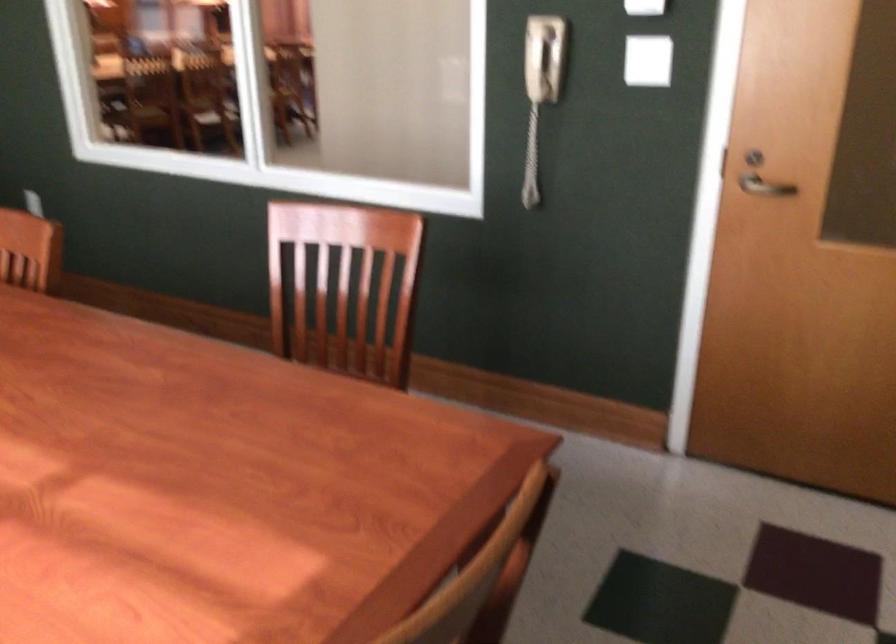
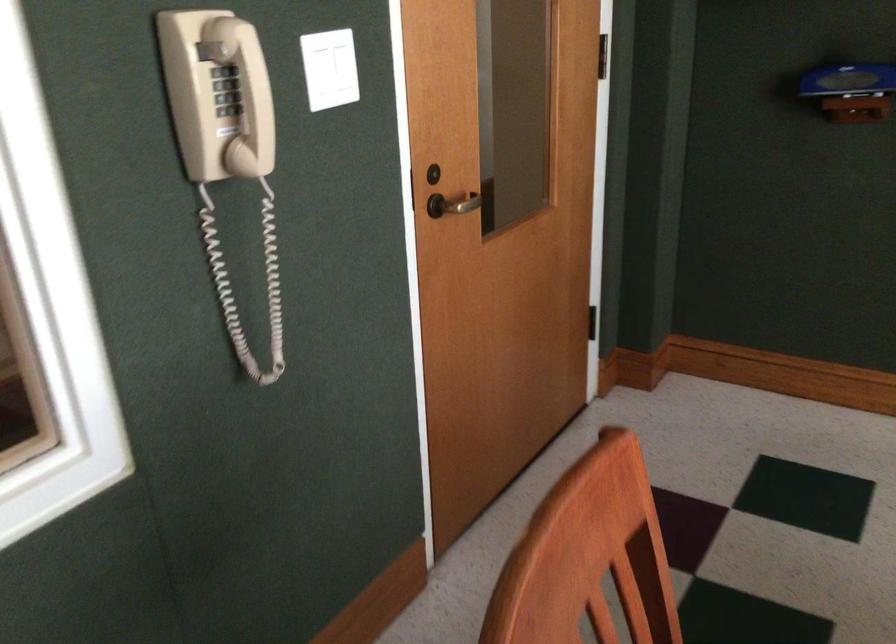
Where in the second image is the point corresponding to (x=750, y=187) from the first image?

(458, 204)